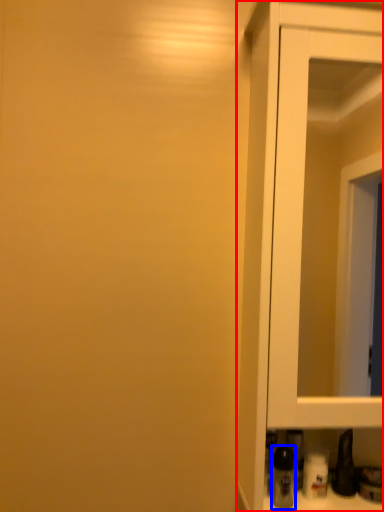
Question: Which of the following is the farthest to the observer, cupboard (highlighted by a red box) or bottle (highlighted by a blue box)?

Choices:
 (A) cupboard
 (B) bottle

Answer: (B)